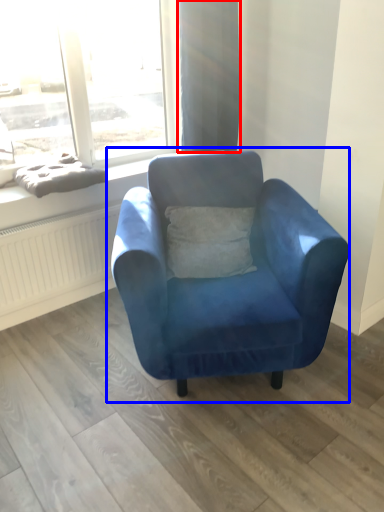
Question: Which object is further to the camera taking this photo, curtain (highlighted by a red box) or chair (highlighted by a blue box)?

Choices:
 (A) curtain
 (B) chair

Answer: (A)